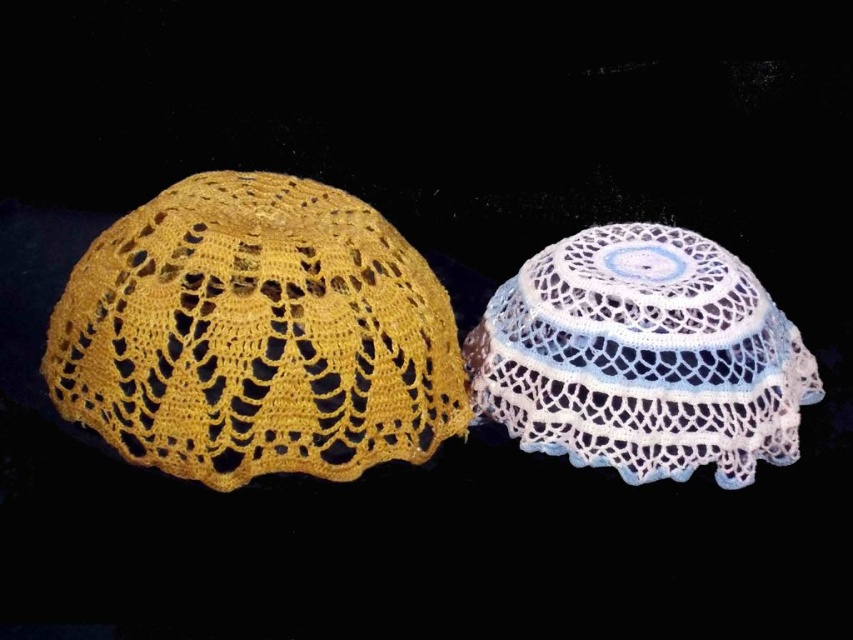
Question: Where is yellow crochet bonnet at left located in relation to white crochet doily at center in the image?

Choices:
 (A) above
 (B) below

Answer: (A)

Question: Among these objects, which one is farthest from the camera?

Choices:
 (A) white crochet doily at center
 (B) yellow crochet bonnet at left

Answer: (A)

Question: Among these objects, which one is farthest from the camera?

Choices:
 (A) yellow crochet bonnet at left
 (B) white crochet doily at center

Answer: (B)

Question: Is yellow crochet bonnet at left positioned before white crochet doily at center?

Choices:
 (A) no
 (B) yes

Answer: (B)

Question: Can you confirm if yellow crochet bonnet at left is bigger than white crochet doily at center?

Choices:
 (A) no
 (B) yes

Answer: (B)